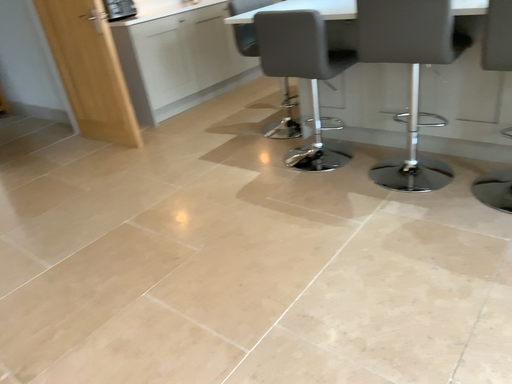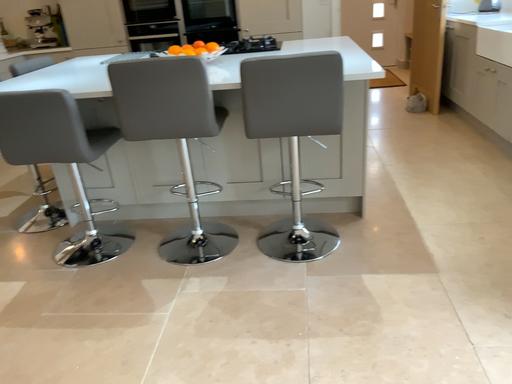
Question: Which way did the camera rotate in the video?

Choices:
 (A) rotated downward
 (B) rotated upward

Answer: (B)